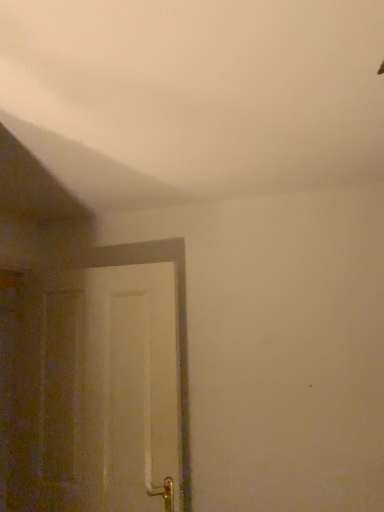
Locate an element on the screen. This screenshot has height=512, width=384. white matte door at left is located at coordinates (107, 385).

What do you see at coordinates (107, 385) in the screenshot? I see `white matte door at left` at bounding box center [107, 385].

I want to click on white matte door at left, so click(x=107, y=385).